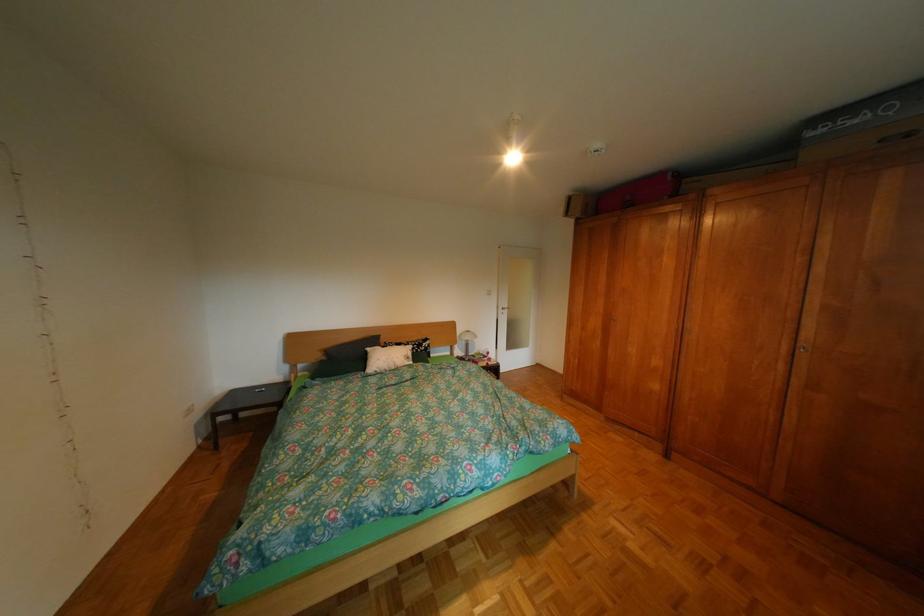
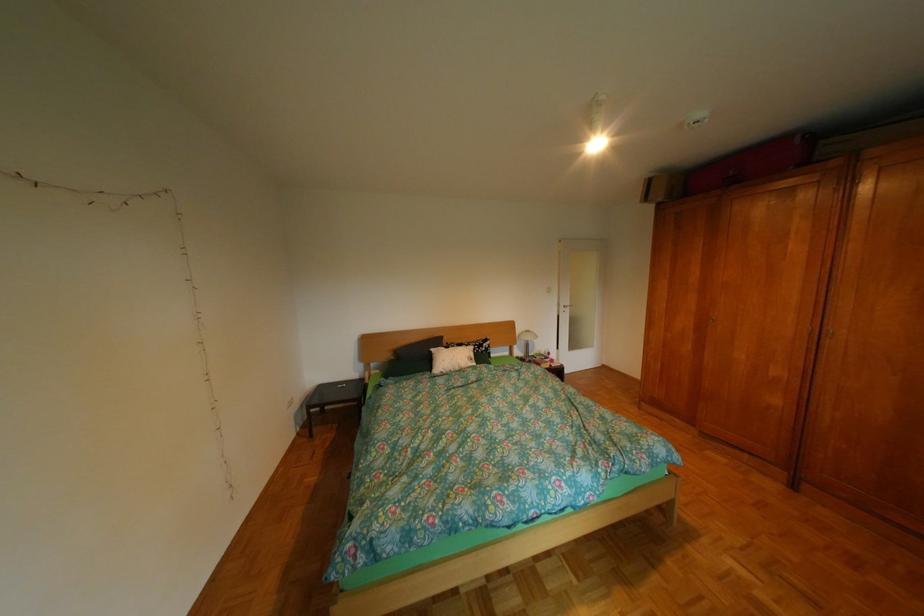
In the second image, find the point that corresponds to pixel 464 349 in the first image.

(523, 349)